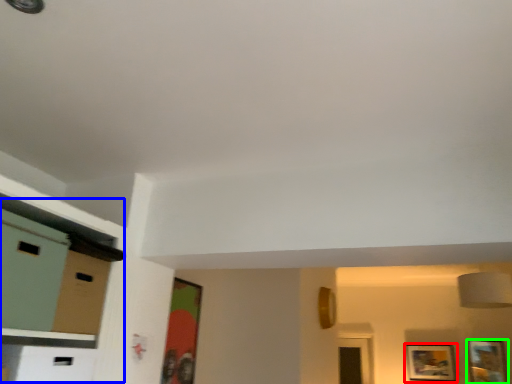
Question: Which object is positioned farthest from picture frame (highlighted by a red box)? Select from dresser (highlighted by a blue box) and picture frame (highlighted by a green box).

Choices:
 (A) dresser
 (B) picture frame

Answer: (A)